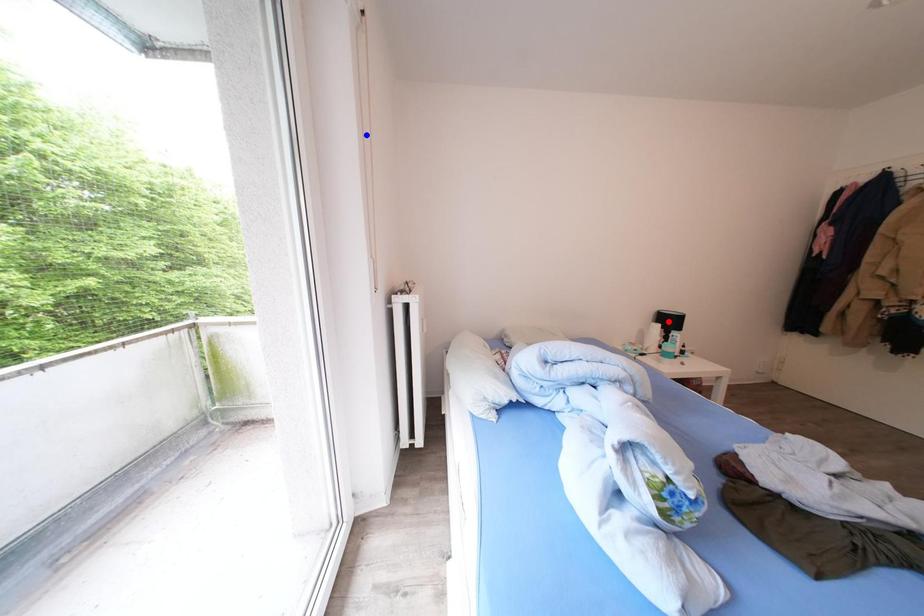
Question: Two points are marked on the image. Which point is closer to the camera?

Choices:
 (A) Blue point is closer.
 (B) Red point is closer.

Answer: (A)